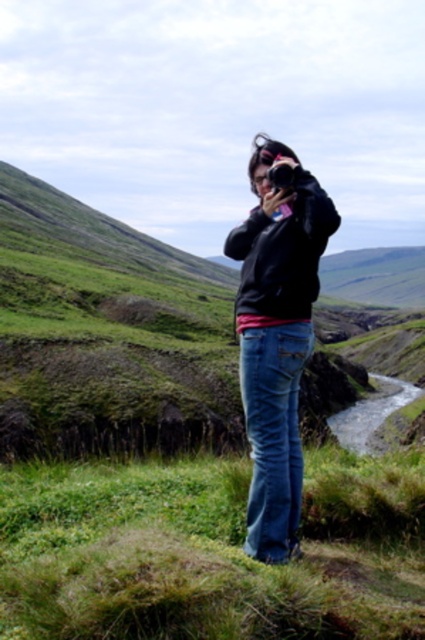
Question: Among these points, which one is nearest to the camera?

Choices:
 (A) (300, 220)
 (B) (299, 177)
 (C) (14, 557)

Answer: (C)

Question: Is matte black hoodie at center positioned in front of black plastic camera at center?

Choices:
 (A) yes
 (B) no

Answer: (A)

Question: Can you confirm if green grassy at center is positioned to the left of matte black hoodie at center?

Choices:
 (A) no
 (B) yes

Answer: (B)

Question: Which object is the closest to the matte black hoodie at center?

Choices:
 (A) green grassy at center
 (B) black plastic camera at center

Answer: (B)

Question: Based on their relative distances, which object is farther from the matte black hoodie at center?

Choices:
 (A) green grassy at center
 (B) black plastic camera at center

Answer: (A)

Question: Can you confirm if green grassy at center is thinner than black plastic camera at center?

Choices:
 (A) no
 (B) yes

Answer: (A)